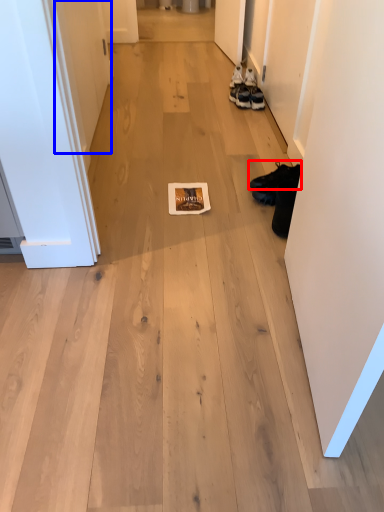
Question: Which object appears closest to the camera in this image, footwear (highlighted by a red box) or door (highlighted by a blue box)?

Choices:
 (A) footwear
 (B) door

Answer: (B)